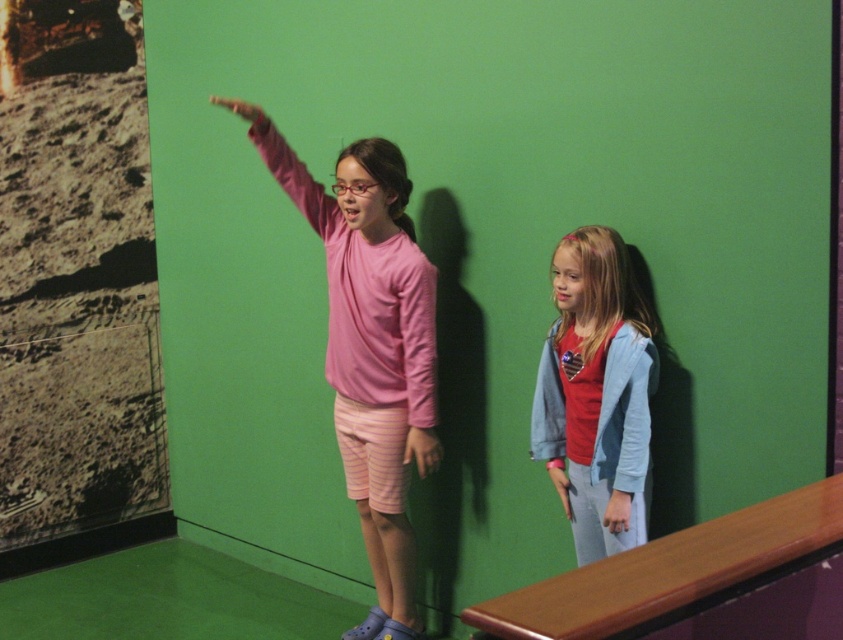
Question: Does pink matte shirt at center lie in front of light blue denim jacket at lower right?

Choices:
 (A) yes
 (B) no

Answer: (B)

Question: Can you confirm if light blue denim jacket at lower right is positioned to the right of pink matte long-sleeve shirt at center?

Choices:
 (A) yes
 (B) no

Answer: (A)

Question: Does pink matte long-sleeve shirt at center appear under pink fabric arm at upper center?

Choices:
 (A) yes
 (B) no

Answer: (A)

Question: Based on their relative distances, which object is farther from the pink matte long-sleeve shirt at center?

Choices:
 (A) light blue fabric at lower right
 (B) pink matte shirt at center

Answer: (A)

Question: Which point is farther from the camera taking this photo?

Choices:
 (A) (552, 291)
 (B) (420, 381)

Answer: (B)

Question: Estimate the real-world distances between objects in this image. Which object is closer to the pink matte shirt at center?

Choices:
 (A) light blue fabric at lower right
 (B) pink matte long-sleeve shirt at center
 (C) denim jacket at right
 (D) light blue denim jacket at lower right

Answer: (B)